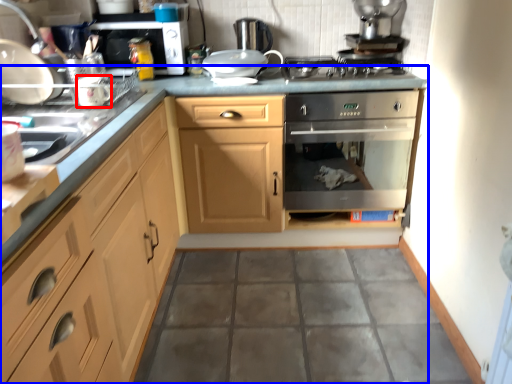
Question: Among these objects, which one is farthest to the camera, appliance (highlighted by a red box) or countertop (highlighted by a blue box)?

Choices:
 (A) appliance
 (B) countertop

Answer: (A)